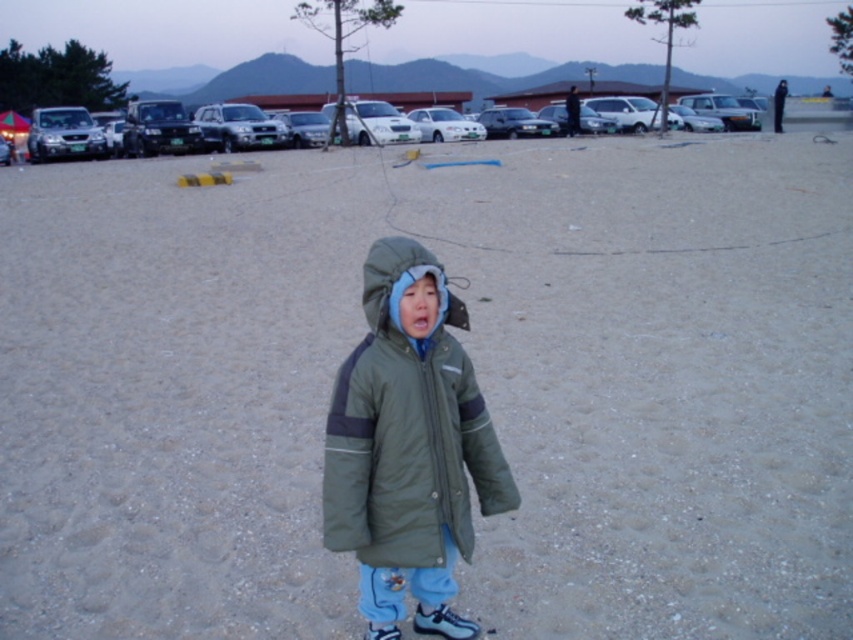
Which is below, green matte jacket at center or metallic gray sedan at center?

green matte jacket at center is lower down.

Is green matte jacket at center further to camera compared to metallic gray sedan at center?

No, it is not.

Who is more distant from viewer, (392, 474) or (520, 115)?

Point (520, 115)

Locate an element on the screen. The width and height of the screenshot is (853, 640). green matte jacket at center is located at coordinates (407, 429).

Is metallic silver suv at upper center below white glossy car at center?

Actually, metallic silver suv at upper center is above white glossy car at center.

Is point (437, 106) behind point (421, 124)?

Yes, it is.

I want to click on metallic silver suv at upper center, so click(x=206, y=134).

Does silver metallic suv at upper left appear over sleek silver sedan at center?

Yes, silver metallic suv at upper left is above sleek silver sedan at center.

Does silver metallic suv at upper left have a greater height compared to sleek silver sedan at center?

Indeed, silver metallic suv at upper left has a greater height compared to sleek silver sedan at center.

This screenshot has height=640, width=853. In order to click on silver metallic suv at upper left in this screenshot , I will do `click(238, 128)`.

At what (x,y) coordinates should I click in order to perform the action: click on silver metallic suv at upper left. Please return your answer as a coordinate pair (x, y). Looking at the image, I should click on (238, 128).